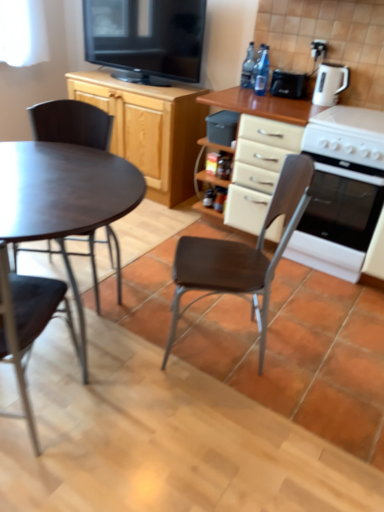
I want to click on free space above black plastic toaster at upper right, which appears as the 1th appliance when viewed from the right (from a real-world perspective), so click(x=299, y=66).